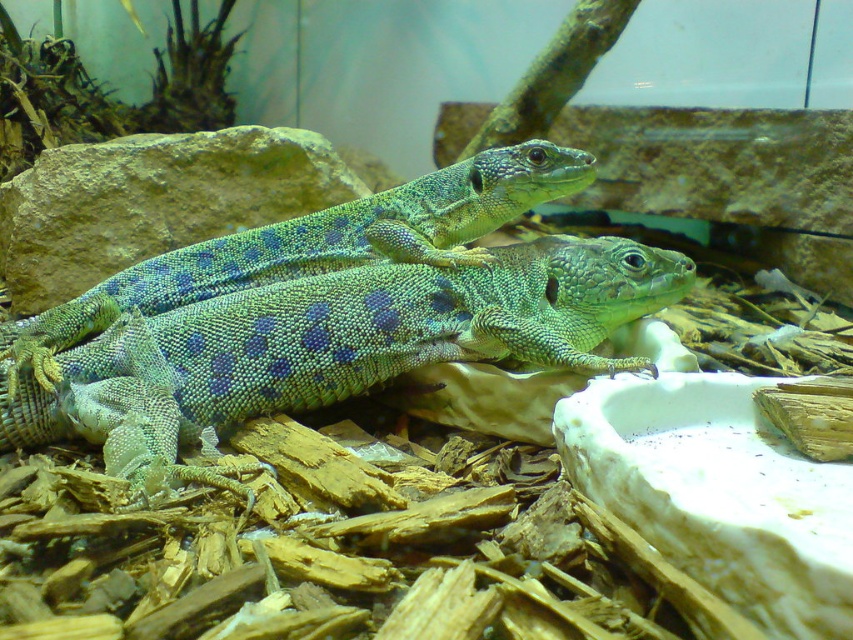
You are a reptile keeper checking the enclosure. You need to identify which lizard is bigger. Which one is larger between the green textured lizard at center and the green scaly lizard at center?

The green textured lizard at center is larger in size than the green scaly lizard at center.

You are a reptile keeper who needs to ensure the lizards have enough space to move around. The minimum recommended distance between two lizards of this species is 6 inches. Based on the image, can the green textured lizard at center and the green scaly lizard at center maintain the required distance?

The distance between the green textured lizard at center and the green scaly lizard at center is 6.85 inches, which exceeds the minimum recommended distance of 6 inches. Therefore, they can maintain the required space.